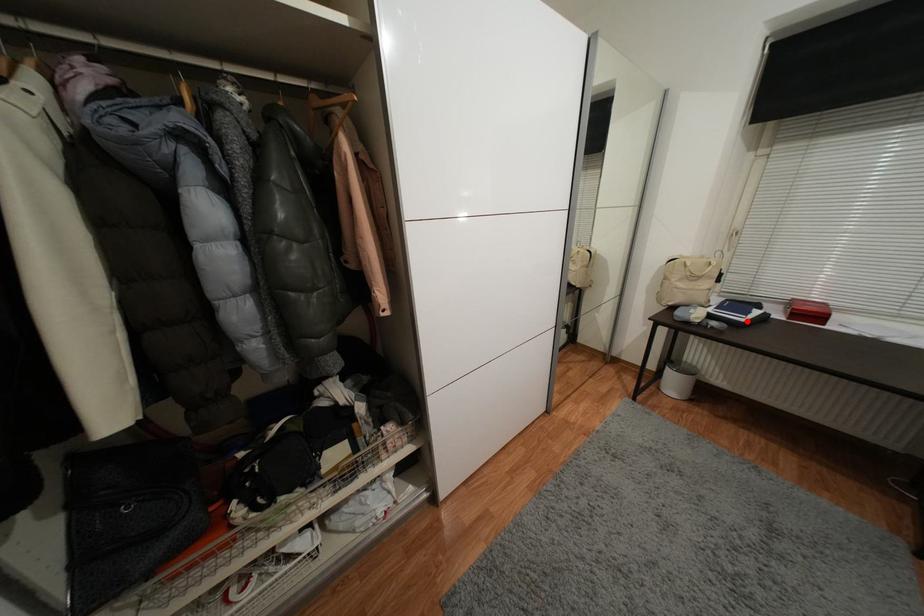
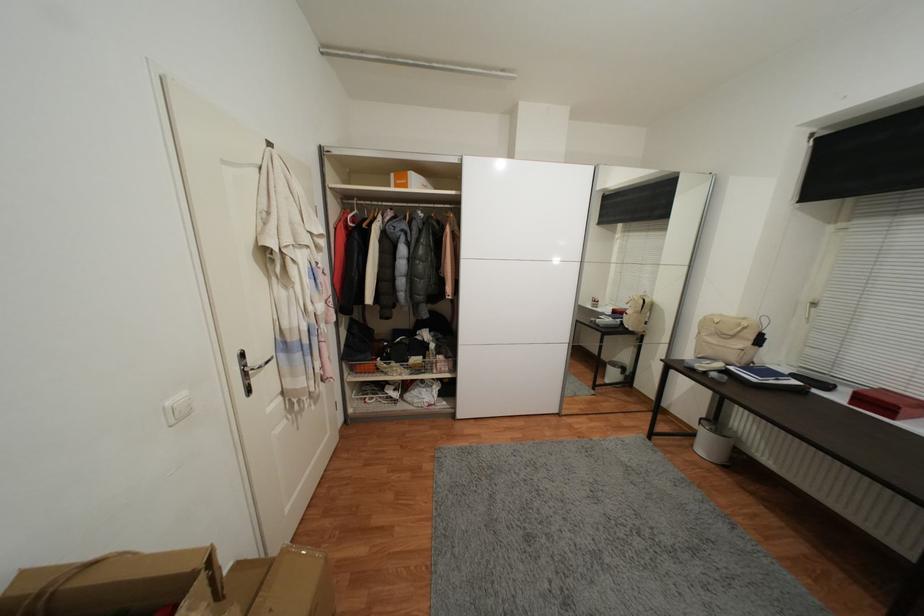
Question: I am providing you with two images of the same scene from different viewpoints. A red point is marked on the first image. Is the red point's position out of view in image 2?

Choices:
 (A) Yes
 (B) No

Answer: (B)